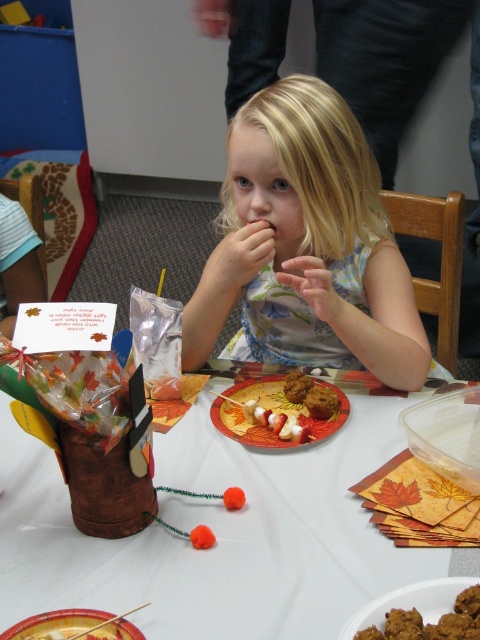
Can you confirm if blonde hair at center is positioned to the left of smooth skin hand at center?

Correct, you'll find blonde hair at center to the left of smooth skin hand at center.

Does blonde hair at center appear over smooth skin hand at center?

Indeed, blonde hair at center is positioned over smooth skin hand at center.

Locate an element on the screen. Image resolution: width=480 pixels, height=640 pixels. blonde hair at center is located at coordinates (307, 244).

Which is below, white paper plate at center or brown matte cookies at center?

brown matte cookies at center is lower down.

Which is behind, point (35, 584) or point (369, 604)?

The point (35, 584) is behind.

Find the location of `white paper plate at center`. white paper plate at center is located at coordinates (215, 532).

Can you confirm if blonde hair at center is wider than matte red plate at center?

Indeed, blonde hair at center has a greater width compared to matte red plate at center.

Does point (268, 192) come in front of point (276, 404)?

Yes.

What are the coordinates of `blonde hair at center` in the screenshot? It's located at (307, 244).